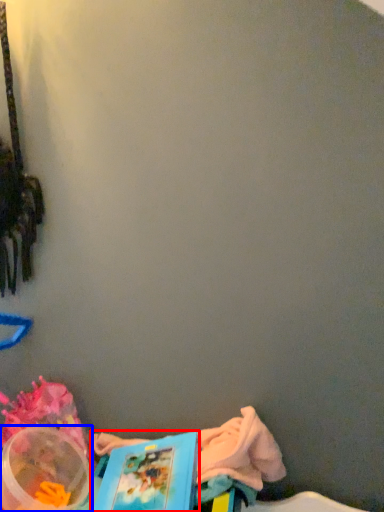
Question: Which object appears farthest to the camera in this image, book (highlighted by a red box) or storage box (highlighted by a blue box)?

Choices:
 (A) book
 (B) storage box

Answer: (B)